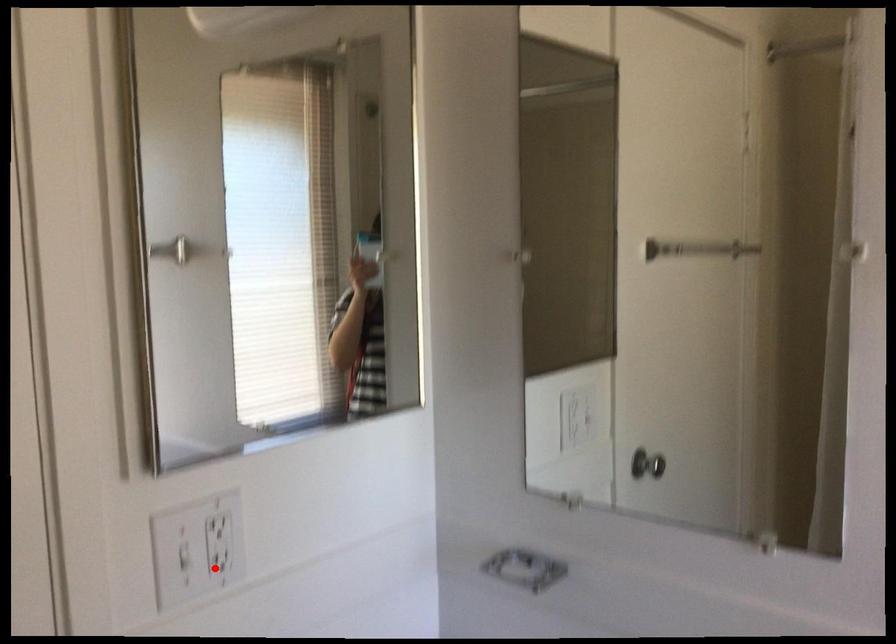
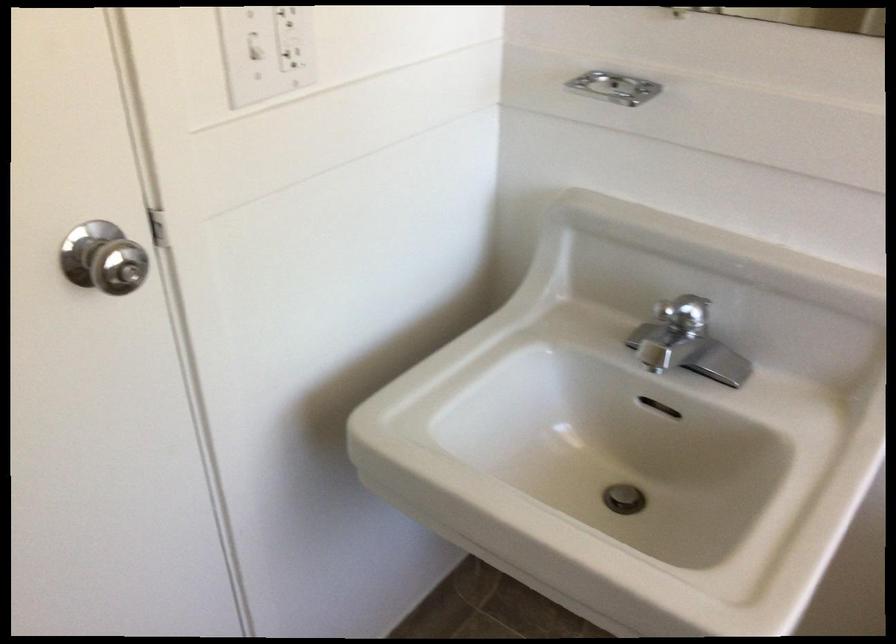
Question: I am providing you with two images of the same scene from different viewpoints. Given a red point in image1, look at the same physical point in image2. Is it:

Choices:
 (A) Closer to the viewpoint
 (B) Farther from the viewpoint

Answer: (A)